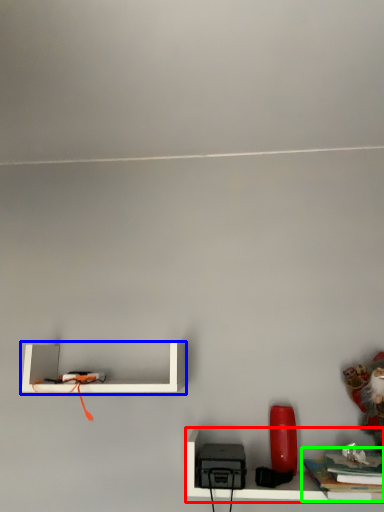
Question: Which object is positioned farthest from shelf (highlighted by a red box)? Select from shelf (highlighted by a blue box) and book (highlighted by a green box).

Choices:
 (A) shelf
 (B) book

Answer: (A)